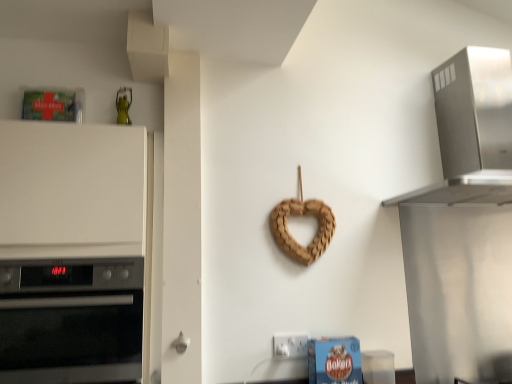
Question: Is white plastic electric outlet at lower center oriented towards white matte oven at left?

Choices:
 (A) no
 (B) yes

Answer: (A)

Question: Does white plastic electric outlet at lower center have a larger size compared to white matte oven at left?

Choices:
 (A) no
 (B) yes

Answer: (A)

Question: From a real-world perspective, is white plastic electric outlet at lower center over white matte oven at left?

Choices:
 (A) no
 (B) yes

Answer: (A)

Question: Does white plastic electric outlet at lower center touch white matte oven at left?

Choices:
 (A) yes
 (B) no

Answer: (B)

Question: Considering the relative sizes of white plastic electric outlet at lower center and white matte oven at left in the image provided, is white plastic electric outlet at lower center shorter than white matte oven at left?

Choices:
 (A) yes
 (B) no

Answer: (A)

Question: Is braided wood heart at center to the left or to the right of stainless steel range hood at upper right in the image?

Choices:
 (A) right
 (B) left

Answer: (B)

Question: Is braided wood heart at center in front of or behind stainless steel range hood at upper right in the image?

Choices:
 (A) behind
 (B) front

Answer: (A)

Question: Is point (331, 213) positioned closer to the camera than point (458, 130)?

Choices:
 (A) closer
 (B) farther

Answer: (A)

Question: Considering the positions of braided wood heart at center and stainless steel range hood at upper right in the image, is braided wood heart at center wider or thinner than stainless steel range hood at upper right?

Choices:
 (A) wide
 (B) thin

Answer: (B)

Question: From a real-world perspective, is braided wood heart at center physically located above or below white matte oven at left?

Choices:
 (A) above
 (B) below

Answer: (A)

Question: Which is correct: braided wood heart at center is inside white matte oven at left, or outside of it?

Choices:
 (A) outside
 (B) inside

Answer: (A)

Question: Is braided wood heart at center taller or shorter than white matte oven at left?

Choices:
 (A) short
 (B) tall

Answer: (A)

Question: From the image's perspective, is braided wood heart at center positioned above or below white matte oven at left?

Choices:
 (A) above
 (B) below

Answer: (A)

Question: From a real-world perspective, is stainless steel range hood at upper right positioned above or below white plastic electric outlet at lower center?

Choices:
 (A) above
 (B) below

Answer: (A)

Question: Is stainless steel range hood at upper right situated inside white plastic electric outlet at lower center or outside?

Choices:
 (A) outside
 (B) inside

Answer: (A)